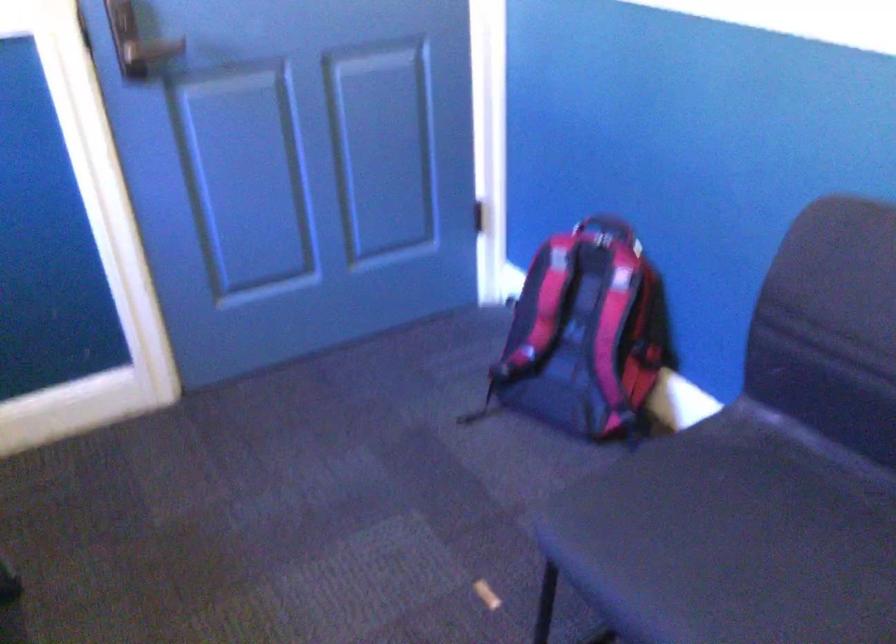
The image size is (896, 644). Describe the element at coordinates (152, 50) in the screenshot. I see `a door handle` at that location.